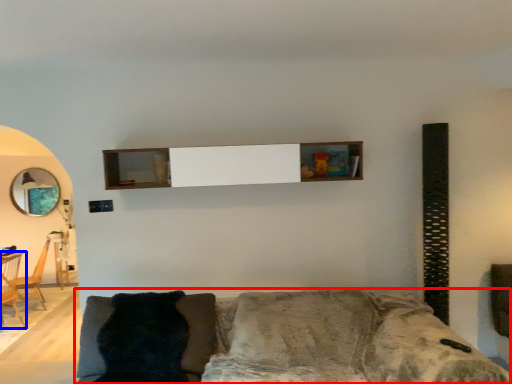
Question: Which of the following is the closest to the observer, studio couch (highlighted by a red box) or armchair (highlighted by a blue box)?

Choices:
 (A) studio couch
 (B) armchair

Answer: (A)